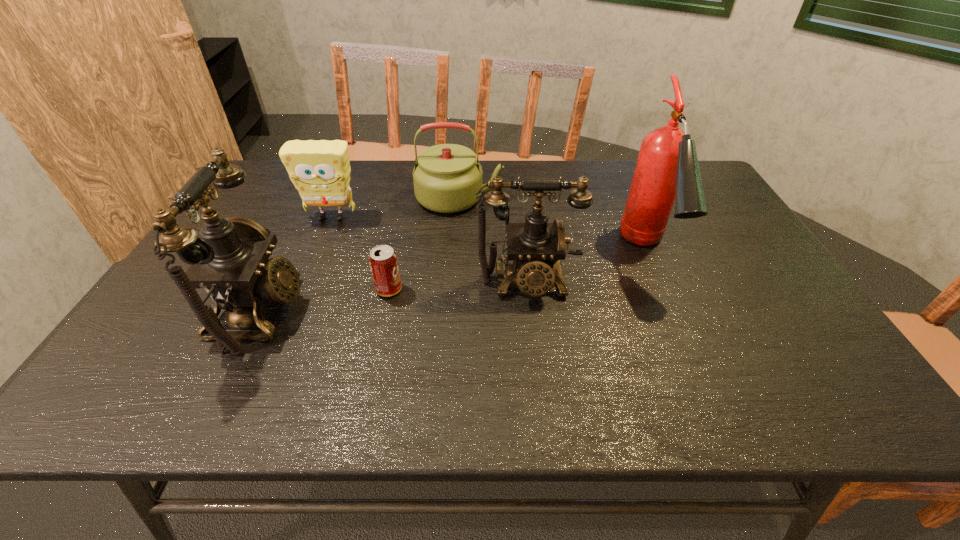
Locate an element on the screen. This screenshot has width=960, height=540. free space located on the face of the sponge is located at coordinates (319, 249).

I want to click on free space located at the spout of the kettle, so click(579, 198).

What are the coordinates of `vacant region located 0.090m at the nozzle end of the fire extinguisher` in the screenshot? It's located at (678, 322).

The height and width of the screenshot is (540, 960). I want to click on blank area located 0.160m on the left of the soda can, so click(x=311, y=289).

Identify the location of object situated at the far edge. (446, 177).

Image resolution: width=960 pixels, height=540 pixels. Find the location of `object that is at the near edge`. object that is at the near edge is located at coordinates (231, 262).

The image size is (960, 540). I want to click on object present at the left edge, so point(231,262).

Where is `object present at the near left corner`? Image resolution: width=960 pixels, height=540 pixels. object present at the near left corner is located at coordinates [231, 262].

Identify the location of blank space at the far edge of the desktop. (607, 178).

The width and height of the screenshot is (960, 540). What are the coordinates of `vacant space at the near edge of the desktop` in the screenshot? It's located at (423, 365).